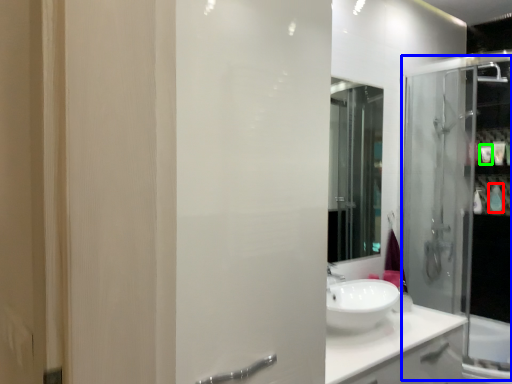
Question: Which is nearer to the toiletry (highlighted by a red box)? shower door (highlighted by a blue box) or toiletry (highlighted by a green box).

Choices:
 (A) shower door
 (B) toiletry

Answer: (B)